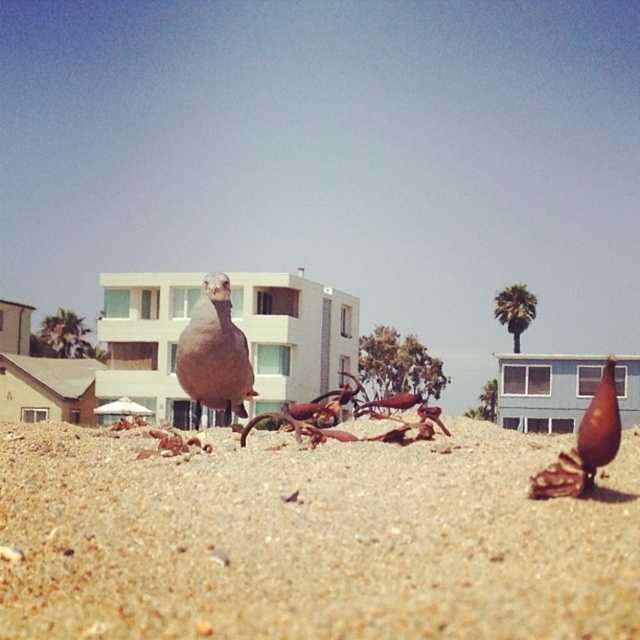
Question: Does brown sandy beach at center have a larger size compared to brown matte gourd at lower right?

Choices:
 (A) yes
 (B) no

Answer: (B)

Question: Is brown matte bird at center below brown matte gourd at lower right?

Choices:
 (A) yes
 (B) no

Answer: (B)

Question: Which object is closer to the camera taking this photo?

Choices:
 (A) brown matte gourd at lower right
 (B) brown sandy beach at center

Answer: (B)

Question: Which point is closer to the camera?

Choices:
 (A) brown matte bird at center
 (B) brown sandy beach at center
 (C) brown matte gourd at lower right

Answer: (B)

Question: Does brown sandy beach at center have a greater width compared to brown matte bird at center?

Choices:
 (A) yes
 (B) no

Answer: (B)

Question: Estimate the real-world distances between objects in this image. Which object is closer to the brown matte gourd at lower right?

Choices:
 (A) brown sandy beach at center
 (B) brown matte bird at center

Answer: (A)